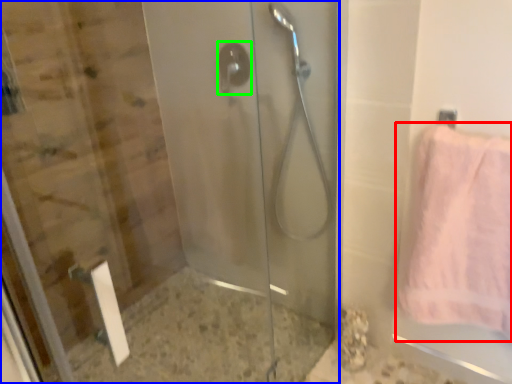
Question: Based on their relative distances, which object is farther from towel (highlighted by a red box)? Choose from screen door (highlighted by a blue box) and shower (highlighted by a green box).

Choices:
 (A) screen door
 (B) shower

Answer: (B)